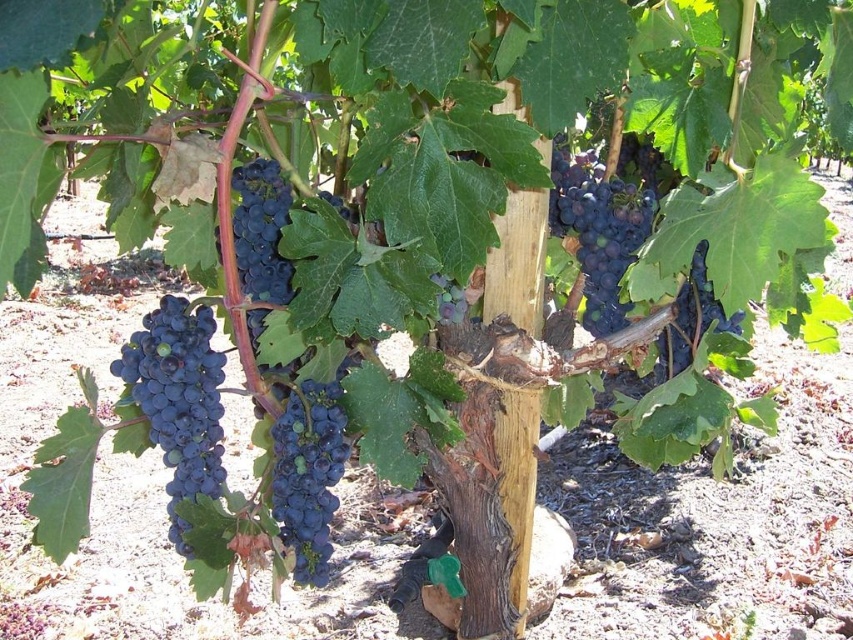
You are a bird perched on a branch above the vineyard. You see two bunches of shiny dark purple grapes at left and shiny dark purple grapes at center. Which bunch is directly below the other?

The shiny dark purple grapes at left is positioned under the shiny dark purple grapes at center, so the grapes at left are directly below the ones at center.

You are standing in a vineyard and see a wooden stake with a grapevine. There is a point marked at coordinates (602, 221). What is located at that point?

At point (602, 221) lies shiny dark purple grapes at center.

You are standing in the vineyard looking at the grapevine. There are two points marked on the image. Which point, point (183,330) or point (555,168), is closer to you?

Point (183,330) is closer to the viewer than point (555,168).